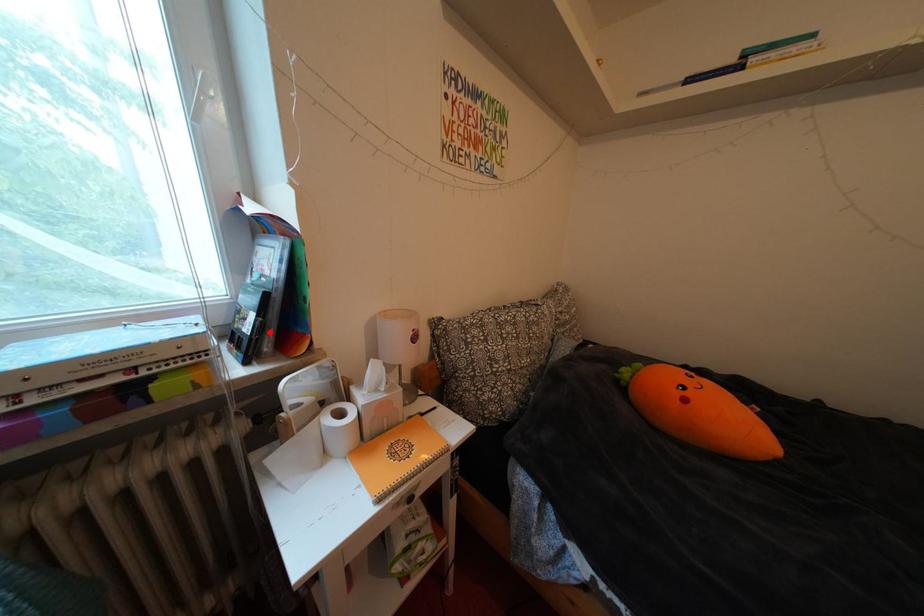
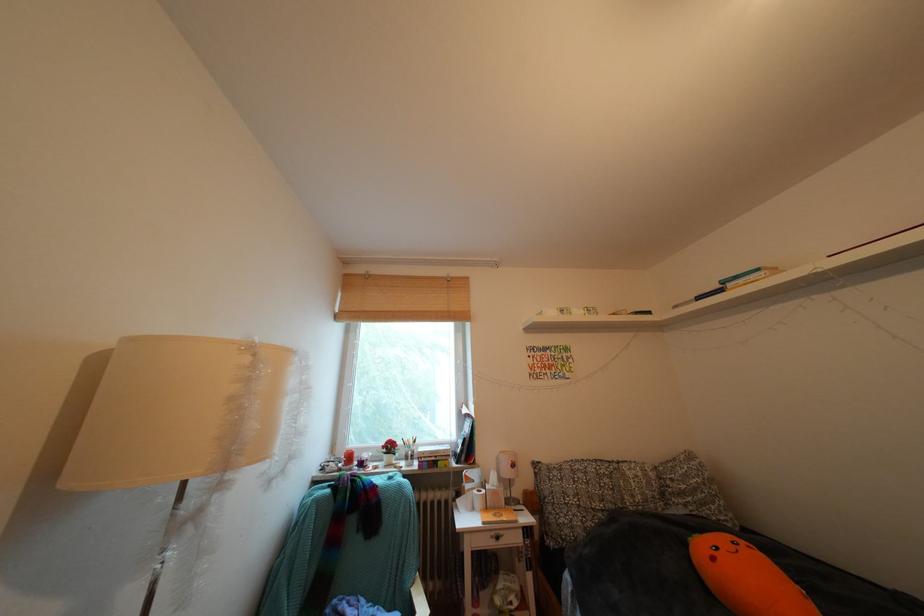
Where in the second image is the point corresponding to the highlighted location from the first image?

(472, 456)